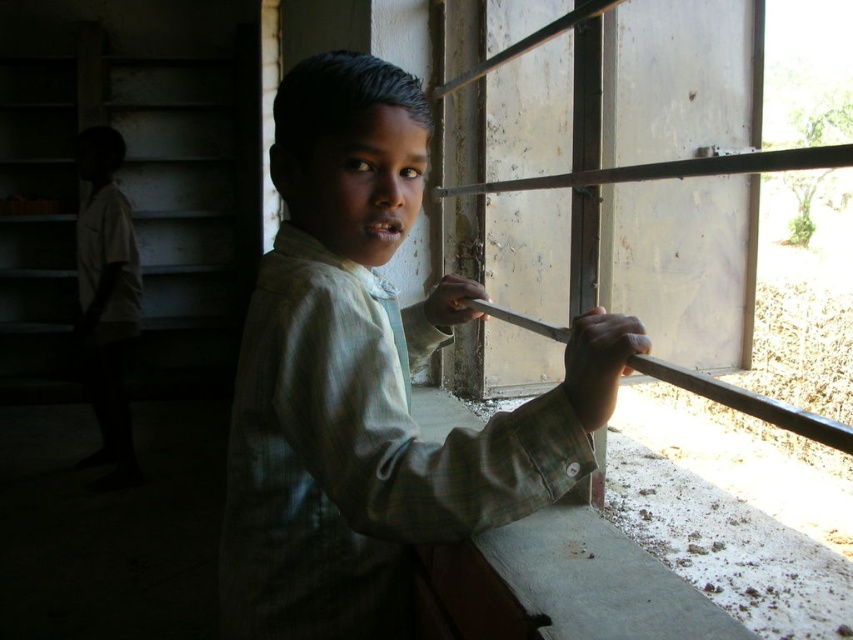
The boy is holding a metallic rod. Where is the green plaid shirt at center in relation to the boy?

The green plaid shirt at center is located at point (370, 381) in the image, which is at the center position relative to the boy.

You are a safety inspector examining the building. You notice the green plaid shirt at center and the metallic smooth rail at upper right. Based on their positions, which object is closer to the ground?

The green plaid shirt at center is closer to the ground because it is positioned below the metallic smooth rail at upper right.

You are the boy in the image holding the metallic rod. You want to poke the point at coordinates point (740,394) with your rod. However, there is another point at point (337,120) closer to you. Will the rod reach the farther point before hitting the closer one?

The point at point (337,120) is closer to you than the point at point (740,394). Therefore, the rod will hit the closer point before reaching the farther one.